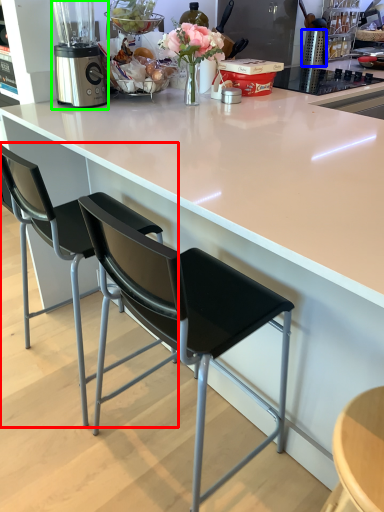
Question: Based on their relative distances, which object is farther from chair (highlighted by a red box)? Choose from kitchen appliance (highlighted by a blue box) and blender (highlighted by a green box).

Choices:
 (A) kitchen appliance
 (B) blender

Answer: (A)